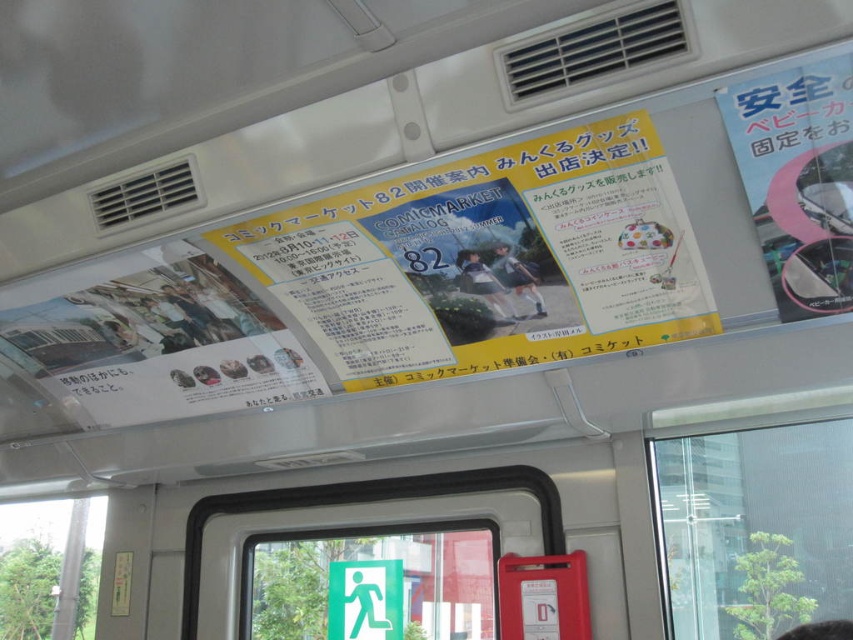
You are a traveler who wants to check the weather outside. You see a transparent glass window at upper center and a matte black skirt at center. Which object can you look through to see the outside?

The transparent glass window at upper center is bigger than matte black skirt at center, so you can look through the transparent glass window at upper center to see the outside.

You are a passenger on the train and need to locate the exit. You see the green glossy exit sign at center and the white paper poster at upper right. Which object is wider?

The green glossy exit sign at center is wider than the white paper poster at upper right according to the description.